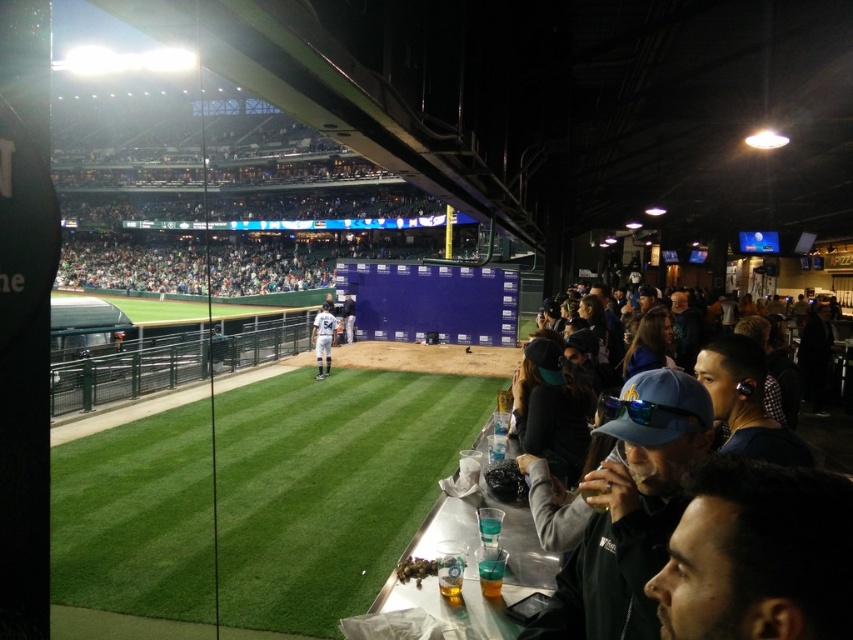
Which is behind, point (326, 364) or point (351, 342)?

The point (351, 342) is more distant.

Is white uniform at center below white jersey at center?

Correct, white uniform at center is located below white jersey at center.

This screenshot has height=640, width=853. I want to click on white uniform at center, so click(322, 339).

Where is `white uniform at center`? This screenshot has width=853, height=640. white uniform at center is located at coordinates (322, 339).

Can you confirm if dark blue jersey at right is positioned to the left of white uniform at center?

In fact, dark blue jersey at right is to the right of white uniform at center.

Does dark blue jersey at right appear over white uniform at center?

Actually, dark blue jersey at right is below white uniform at center.

This screenshot has height=640, width=853. Describe the element at coordinates (630, 513) in the screenshot. I see `dark blue jersey at right` at that location.

Identify the location of dark blue jersey at right. (630, 513).

Can you confirm if dark blue jersey at right is wider than white jersey at center?

Yes, dark blue jersey at right is wider than white jersey at center.

Is dark blue jersey at right above white jersey at center?

No.

Who is more distant from viewer, (596, 602) or (347, 330)?

Point (347, 330)

Find the location of a particular element. dark blue jersey at right is located at coordinates (630, 513).